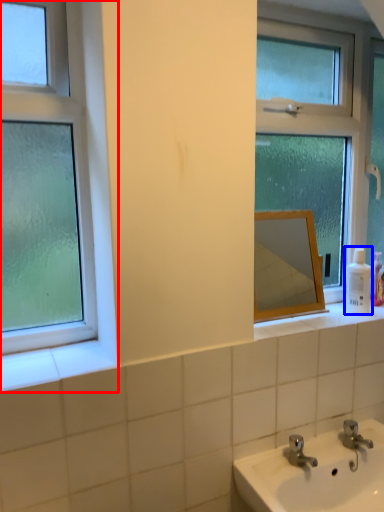
Question: Which point is closer to the camera, window (highlighted by a red box) or toiletry (highlighted by a blue box)?

Choices:
 (A) window
 (B) toiletry

Answer: (A)